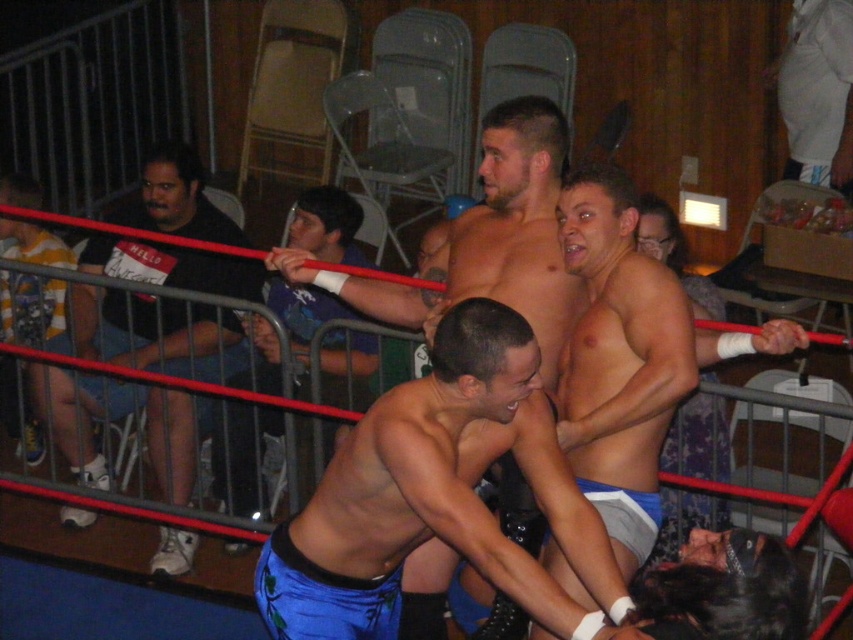
Can you confirm if smooth skin torso at center is wider than shiny blue shorts at center?

No.

Based on the photo, between smooth skin torso at center and shiny blue shorts at center, which one is positioned higher?

Positioned higher is shiny blue shorts at center.

Which is in front, point (573, 352) or point (247, 436)?

Point (573, 352) is in front.

The image size is (853, 640). What are the coordinates of `smooth skin torso at center` in the screenshot? It's located at (619, 358).

Between point (173, 308) and point (577, 356), which one is positioned in front?

Point (577, 356)

This screenshot has width=853, height=640. Identify the location of black cotton shirt at left. (155, 333).

Identify the location of black cotton shirt at left. This screenshot has width=853, height=640. (155, 333).

The height and width of the screenshot is (640, 853). Find the location of `black cotton shirt at left`. black cotton shirt at left is located at coordinates (155, 333).

Is point (374, 346) positioned after point (819, 49)?

No, (374, 346) is in front of (819, 49).

Is shiny blue shorts at center to the right of white fabric pants at upper right from the viewer's perspective?

In fact, shiny blue shorts at center is to the left of white fabric pants at upper right.

Is point (360, 358) behind point (791, 100)?

No, it is not.

Locate an element on the screen. shiny blue shorts at center is located at coordinates (328, 225).